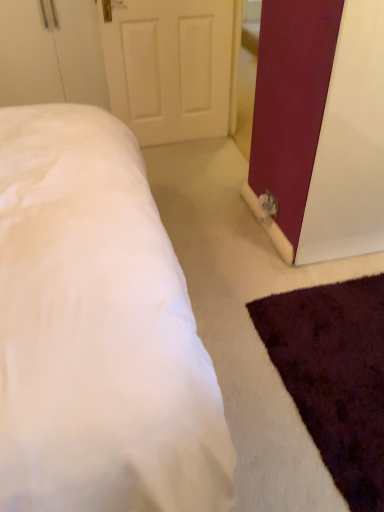
Question: Does white soft bed at lower left have a lesser width compared to white matte door at upper center?

Choices:
 (A) yes
 (B) no

Answer: (B)

Question: Considering the relative sizes of white soft bed at lower left and white matte door at upper center in the image provided, is white soft bed at lower left wider than white matte door at upper center?

Choices:
 (A) no
 (B) yes

Answer: (B)

Question: Does white soft bed at lower left appear on the left side of white matte door at upper center?

Choices:
 (A) no
 (B) yes

Answer: (A)

Question: From the image's perspective, is white soft bed at lower left beneath white matte door at upper center?

Choices:
 (A) no
 (B) yes

Answer: (B)

Question: From a real-world perspective, is white soft bed at lower left positioned under white matte door at upper center based on gravity?

Choices:
 (A) no
 (B) yes

Answer: (A)

Question: From the image's perspective, would you say white soft bed at lower left is positioned over white matte door at upper center?

Choices:
 (A) no
 (B) yes

Answer: (A)

Question: Is matte burgundy barn door at right located within white matte door at upper center?

Choices:
 (A) no
 (B) yes

Answer: (A)

Question: Is white matte door at upper center taller than matte burgundy barn door at right?

Choices:
 (A) yes
 (B) no

Answer: (B)

Question: Is white matte door at upper center outside of matte burgundy barn door at right?

Choices:
 (A) yes
 (B) no

Answer: (A)

Question: Is white matte door at upper center bigger than matte burgundy barn door at right?

Choices:
 (A) yes
 (B) no

Answer: (B)

Question: Is matte burgundy barn door at right at the back of white matte door at upper center?

Choices:
 (A) no
 (B) yes

Answer: (A)

Question: Is white matte door at upper center wider than matte burgundy barn door at right?

Choices:
 (A) yes
 (B) no

Answer: (B)

Question: Is matte burgundy barn door at right wider than white soft bed at lower left?

Choices:
 (A) no
 (B) yes

Answer: (A)